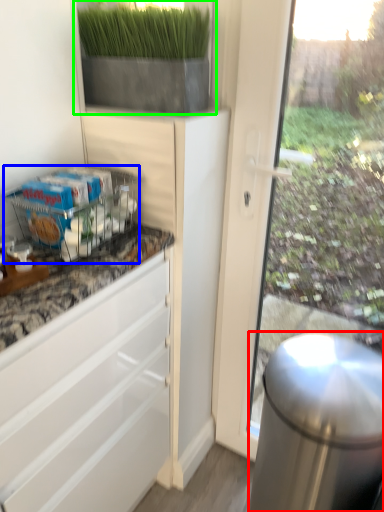
Question: Which is farther away from appliance (highlighted by a red box)? shelf (highlighted by a blue box) or houseplant (highlighted by a green box)?

Choices:
 (A) shelf
 (B) houseplant

Answer: (B)